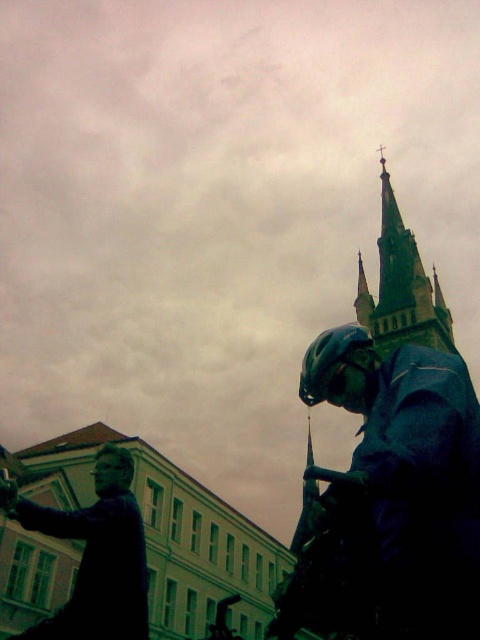
Question: Which point is closer to the camera?

Choices:
 (A) matte black statue at lower left
 (B) shiny dark blue helmet at center

Answer: (B)

Question: Is the position of matte black statue at lower left less distant than that of stone steeple at upper center?

Choices:
 (A) no
 (B) yes

Answer: (B)

Question: Which of the following is the farthest from the observer?

Choices:
 (A) (388, 291)
 (B) (348, 358)

Answer: (A)

Question: Is shiny dark blue helmet at center to the right of stone steeple at upper center from the viewer's perspective?

Choices:
 (A) yes
 (B) no

Answer: (B)

Question: Considering the real-world distances, which object is closest to the stone steeple at upper center?

Choices:
 (A) matte black statue at lower left
 (B) shiny dark blue helmet at center

Answer: (B)

Question: Is shiny dark blue helmet at center below matte black statue at lower left?

Choices:
 (A) no
 (B) yes

Answer: (B)